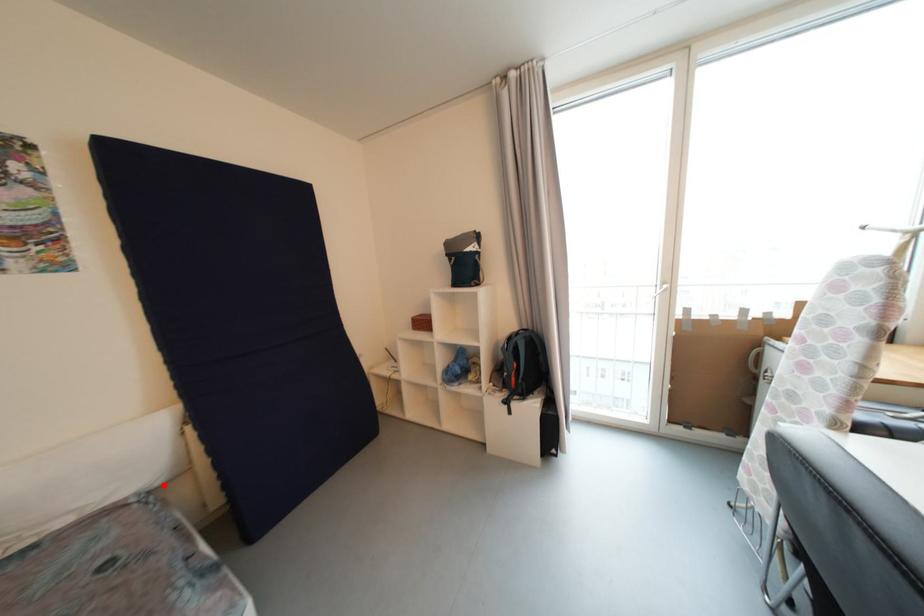
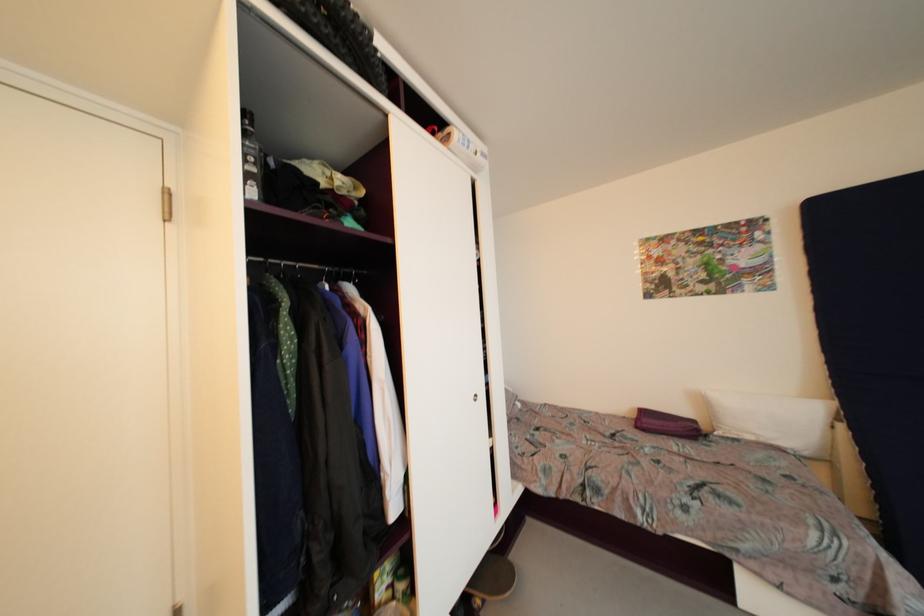
Where in the second image is the point corresponding to the highlighted location from the first image?

(810, 456)